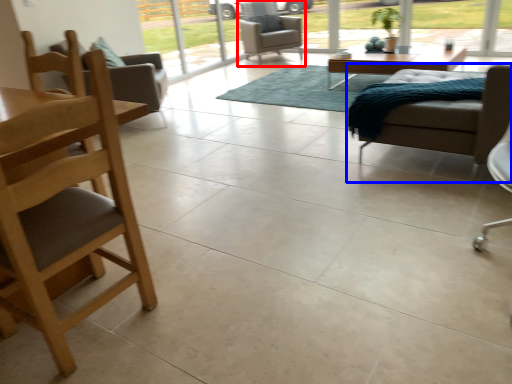
Question: Among these objects, which one is farthest to the camera, chair (highlighted by a red box) or chair (highlighted by a blue box)?

Choices:
 (A) chair
 (B) chair

Answer: (A)